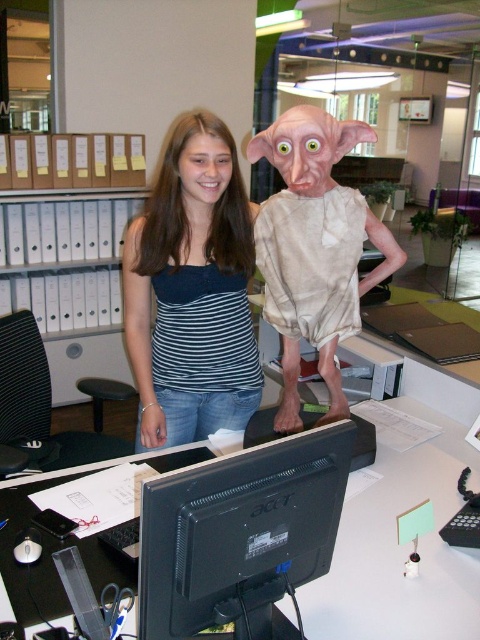
Question: Which point is farther to the camera?

Choices:
 (A) (156, 378)
 (B) (163, 600)

Answer: (A)

Question: Does striped fabric tank top at center appear on the right side of black plastic monitor at center?

Choices:
 (A) yes
 (B) no

Answer: (B)

Question: Where is striped fabric tank top at center located in relation to black plastic monitor at center in the image?

Choices:
 (A) right
 (B) left

Answer: (B)

Question: Is the position of striped fabric tank top at center less distant than that of black plastic monitor at center?

Choices:
 (A) yes
 (B) no

Answer: (B)

Question: Which point is farther to the camera?

Choices:
 (A) (205, 333)
 (B) (218, 467)

Answer: (A)

Question: Which point is farther to the camera?

Choices:
 (A) (160, 401)
 (B) (240, 531)

Answer: (A)